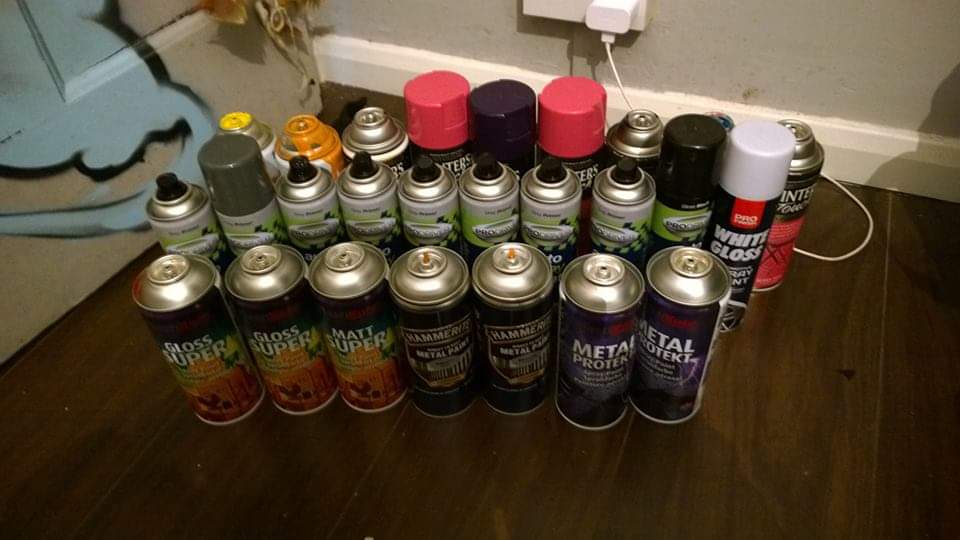
At what (x,y) coordinates should I click in order to perform the action: click on wall. Please return your answer as a coordinate pair (x, y). The image size is (960, 540). Looking at the image, I should click on (781, 60).